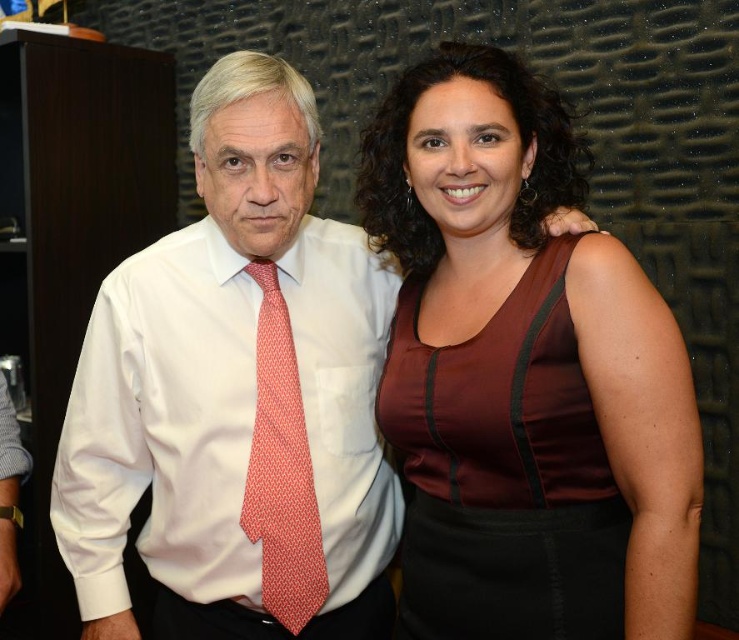
Question: Does white smooth dress shirt at left lie in front of red dotted fabric tie at center?

Choices:
 (A) yes
 (B) no

Answer: (A)

Question: Can you confirm if white smooth dress shirt at left is positioned to the left of red dotted fabric tie at center?

Choices:
 (A) no
 (B) yes

Answer: (B)

Question: Which point is closer to the camera?

Choices:
 (A) (664, 634)
 (B) (372, 320)

Answer: (A)

Question: Which point is farther to the camera?

Choices:
 (A) burgundy satin dress at center
 (B) white smooth dress shirt at left
 (C) white satin shirt at center
 (D) red dotted fabric tie at center

Answer: (D)

Question: Which point is farther to the camera?

Choices:
 (A) white satin shirt at center
 (B) burgundy satin dress at center
 (C) white smooth dress shirt at left
 (D) red dotted fabric tie at center

Answer: (D)

Question: Does white satin shirt at center appear under red dotted fabric tie at center?

Choices:
 (A) yes
 (B) no

Answer: (B)